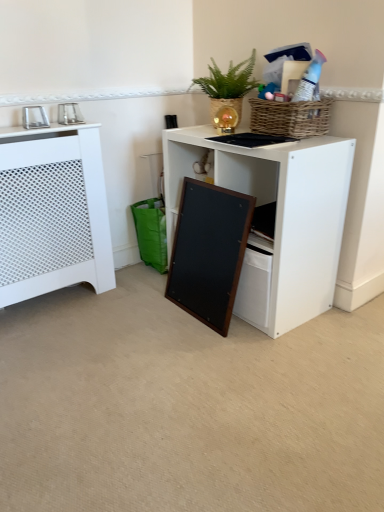
Question: Is metallic silver photo frame at upper left, the 2th appliance viewed from the right, located within metallic silver photo frame at upper left, the 2th appliance when ordered from left to right?

Choices:
 (A) yes
 (B) no

Answer: (B)

Question: Considering the relative sizes of metallic silver photo frame at upper left, the 2th appliance when ordered from left to right, and metallic silver photo frame at upper left, the 2th appliance viewed from the right, in the image provided, is metallic silver photo frame at upper left, the 2th appliance when ordered from left to right, taller than metallic silver photo frame at upper left, the 2th appliance viewed from the right,?

Choices:
 (A) yes
 (B) no

Answer: (B)

Question: Can you confirm if metallic silver photo frame at upper left, the 2th appliance when ordered from left to right, is positioned to the right of metallic silver photo frame at upper left, the 2th appliance viewed from the right?

Choices:
 (A) yes
 (B) no

Answer: (A)

Question: Is metallic silver photo frame at upper left, which is the first appliance from right to left, far from metallic silver photo frame at upper left, the first appliance viewed from the left?

Choices:
 (A) no
 (B) yes

Answer: (A)

Question: Is metallic silver photo frame at upper left, the 2th appliance when ordered from left to right, at the left side of metallic silver photo frame at upper left, the 2th appliance viewed from the right?

Choices:
 (A) no
 (B) yes

Answer: (A)

Question: Can you confirm if metallic silver photo frame at upper left, which is the first appliance from right to left, is thinner than metallic silver photo frame at upper left, the 2th appliance viewed from the right?

Choices:
 (A) yes
 (B) no

Answer: (A)

Question: Does metallic silver photo frame at upper left, the 2th appliance viewed from the right, come behind white perforated radiator at left?

Choices:
 (A) no
 (B) yes

Answer: (B)

Question: Can you confirm if metallic silver photo frame at upper left, the first appliance viewed from the left, is bigger than white perforated radiator at left?

Choices:
 (A) no
 (B) yes

Answer: (A)

Question: From the image's perspective, does metallic silver photo frame at upper left, the first appliance viewed from the left, appear higher than white perforated radiator at left?

Choices:
 (A) yes
 (B) no

Answer: (A)

Question: Considering the relative positions of metallic silver photo frame at upper left, the 2th appliance viewed from the right, and white perforated radiator at left in the image provided, is metallic silver photo frame at upper left, the 2th appliance viewed from the right, to the right of white perforated radiator at left from the viewer's perspective?

Choices:
 (A) yes
 (B) no

Answer: (B)

Question: Considering the relative sizes of metallic silver photo frame at upper left, the first appliance viewed from the left, and white perforated radiator at left in the image provided, is metallic silver photo frame at upper left, the first appliance viewed from the left, thinner than white perforated radiator at left?

Choices:
 (A) yes
 (B) no

Answer: (A)

Question: Considering the relative positions of metallic silver photo frame at upper left, the 2th appliance viewed from the right, and white perforated radiator at left in the image provided, is metallic silver photo frame at upper left, the 2th appliance viewed from the right, to the left of white perforated radiator at left from the viewer's perspective?

Choices:
 (A) no
 (B) yes

Answer: (B)

Question: Is metallic silver photo frame at upper left, the first appliance viewed from the left, not inside wooden frame at lower center?

Choices:
 (A) yes
 (B) no

Answer: (A)